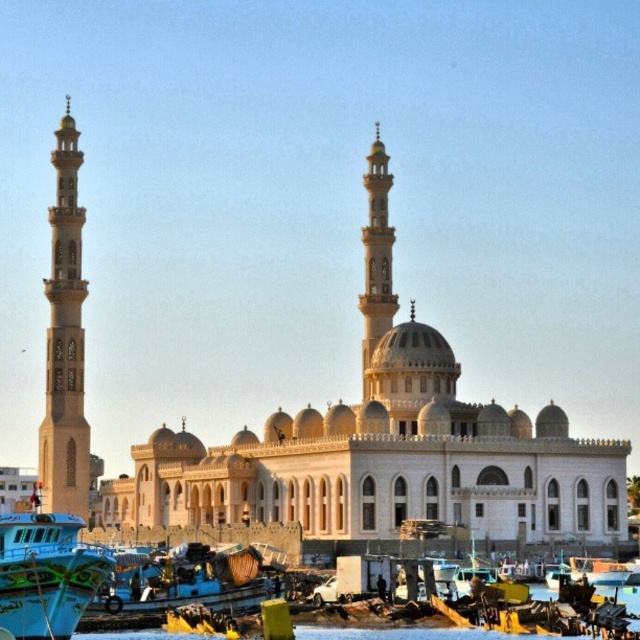
You are standing at the entrance of the mosque and see the blue painted wooden boat at lower left and the blue painted wood boat at lower left. Which boat is positioned higher in the image?

The blue painted wooden boat at lower left is positioned higher than the blue painted wood boat at lower left in the image.

You are standing on the dock and want to compare the height of the blue painted wooden boat at lower left and the beige stone minaret at center. Which one is taller?

The beige stone minaret at center is taller than the blue painted wooden boat at lower left.

You are standing on the dock near the mosque and want to board a boat. Which boat is narrower between the blue painted wooden boat at lower left and the blue painted wood boat at lower left?

The blue painted wooden boat at lower left is thinner than the blue painted wood boat at lower left, so it is narrower.